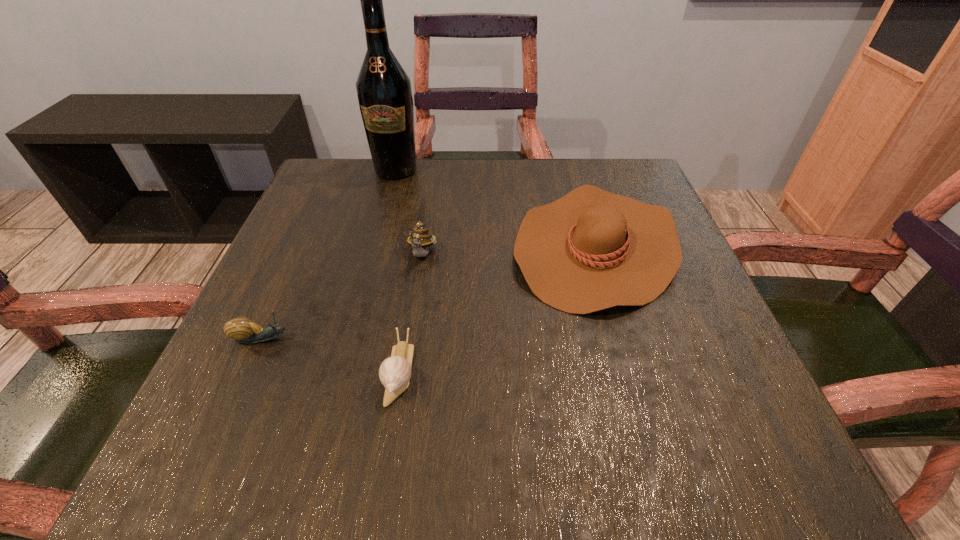
Locate an element on the screen. This screenshot has width=960, height=540. free space at the left edge of the desktop is located at coordinates (324, 298).

This screenshot has height=540, width=960. Find the location of `free region at the right edge of the desktop`. free region at the right edge of the desktop is located at coordinates (692, 351).

In the image, there is a desktop. Identify the location of free region at the far left corner. (371, 214).

Identify the location of vacant area at the near left corner of the desktop. Image resolution: width=960 pixels, height=540 pixels. (196, 469).

The image size is (960, 540). In the image, there is a desktop. In order to click on vacant space at the far right corner in this screenshot , I will do `click(626, 176)`.

This screenshot has height=540, width=960. I want to click on free space between the cowboy hat and the tallest escargot, so click(510, 251).

Find the location of `free space that is in between the farthest escargot and the third shortest object`. free space that is in between the farthest escargot and the third shortest object is located at coordinates tap(510, 251).

In order to click on vacant region between the third shortest object and the leftmost object in this screenshot , I will do `click(430, 292)`.

Image resolution: width=960 pixels, height=540 pixels. What are the coordinates of `vacant area that lies between the leftmost escargot and the tallest escargot` in the screenshot? It's located at (343, 297).

Image resolution: width=960 pixels, height=540 pixels. What are the coordinates of `free space between the rightmost object and the leftmost object` in the screenshot? It's located at (430, 292).